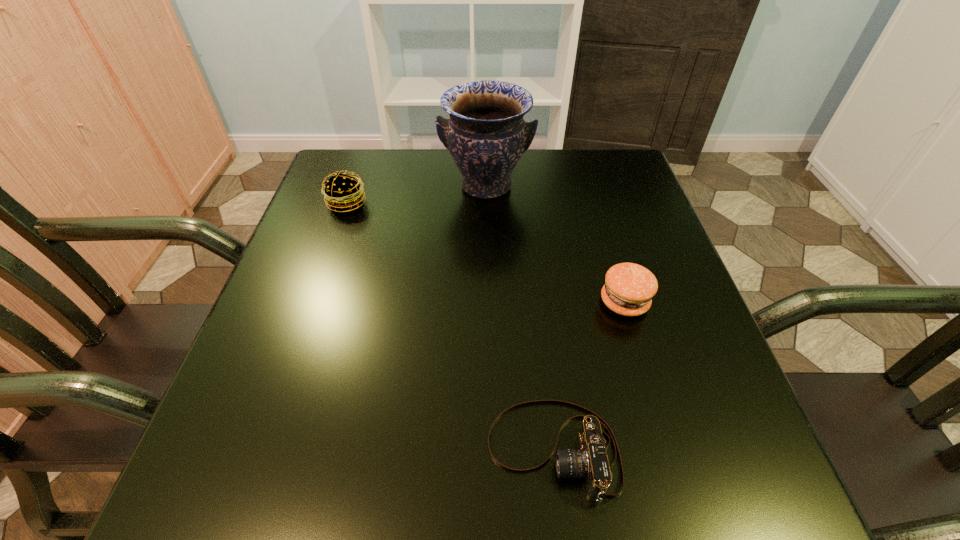
In the image, there is a desktop. Where is `vacant space at the near edge`? This screenshot has height=540, width=960. vacant space at the near edge is located at coordinates (341, 514).

Identify the location of vacant space at the left edge of the desktop. (324, 406).

In the image, there is a desktop. Where is `blank space at the right edge`? This screenshot has height=540, width=960. blank space at the right edge is located at coordinates (627, 244).

Image resolution: width=960 pixels, height=540 pixels. Find the location of `free space at the far left corner`. free space at the far left corner is located at coordinates (379, 177).

In the image, there is a desktop. Where is `vacant space at the far right corner`? Image resolution: width=960 pixels, height=540 pixels. vacant space at the far right corner is located at coordinates click(597, 162).

Image resolution: width=960 pixels, height=540 pixels. Identify the location of blank space at the near right corner of the desktop. (725, 462).

The image size is (960, 540). Identify the location of vacant point located between the third farthest object and the pottery. (555, 244).

Find the location of `free spot between the second nearest object and the pottery`. free spot between the second nearest object and the pottery is located at coordinates click(x=555, y=244).

You are a GUI agent. You are given a task and a screenshot of the screen. Output one action in this format:
    pyautogui.click(x=<x>, y=<y>)
    Task: Click on the vacant point located between the nearest object and the leftmost object
    The width and height of the screenshot is (960, 540).
    Given the screenshot: What is the action you would take?
    pyautogui.click(x=450, y=327)

This screenshot has width=960, height=540. I want to click on free space between the pottery and the right patty, so click(x=555, y=244).